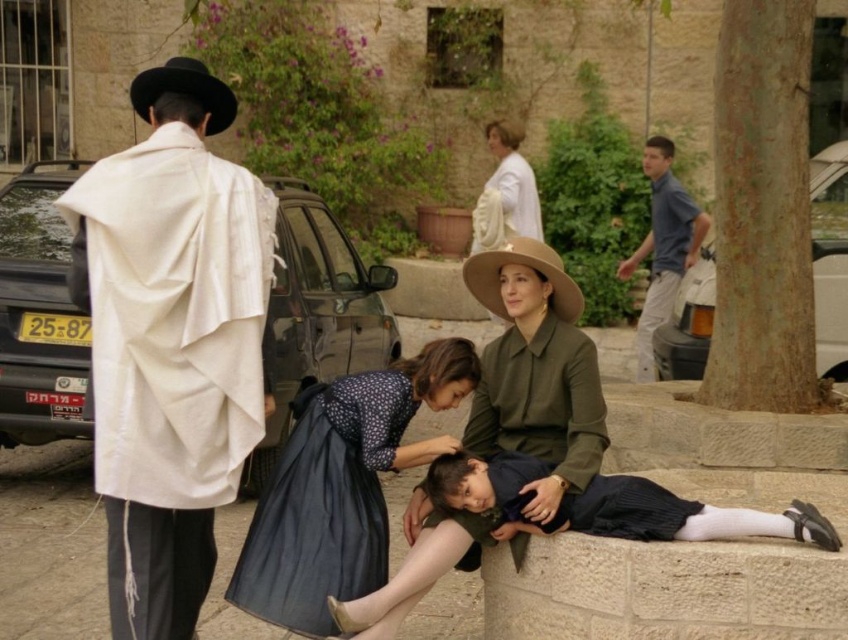
Which of these two, white textured coat at left or black felt cowboy hat at upper left, stands taller?

white textured coat at left

Is point (180, 563) positioned after point (201, 61)?

No, (180, 563) is closer to viewer.

Identify the location of white textured coat at left. The height and width of the screenshot is (640, 848). (171, 342).

Between blue cotton shirt at right and white matte dress at upper center, which one has less height?

white matte dress at upper center is shorter.

Who is more forward, [643,257] or [494,244]?

Point [494,244] is in front.

What do you see at coordinates (662, 248) in the screenshot? I see `blue cotton shirt at right` at bounding box center [662, 248].

Identify the location of blue cotton shirt at right. (x=662, y=248).

Between white textured coat at left and dark blue satin dress at lower center, which one appears on the left side from the viewer's perspective?

Positioned to the left is white textured coat at left.

Between white textured coat at left and dark blue satin dress at lower center, which one has less height?

dark blue satin dress at lower center is shorter.

Between point (159, 196) and point (307, 406), which one is positioned behind?

The point (307, 406) is behind.

You are a GUI agent. You are given a task and a screenshot of the screen. Output one action in this format:
    pyautogui.click(x=<x>, y=<y>)
    Task: Click on the white textured coat at left
    This screenshot has height=640, width=848.
    Given the screenshot: What is the action you would take?
    pyautogui.click(x=171, y=342)